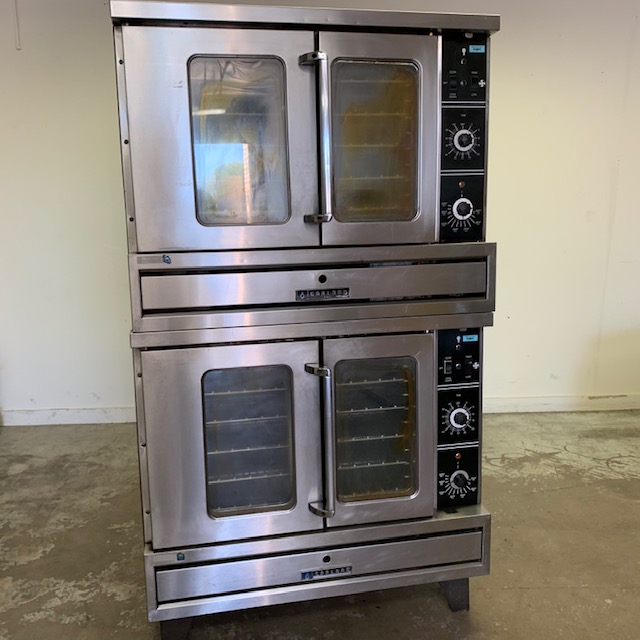
Where is `brown and gray concrete floor`? This screenshot has height=640, width=640. brown and gray concrete floor is located at coordinates click(x=569, y=548).